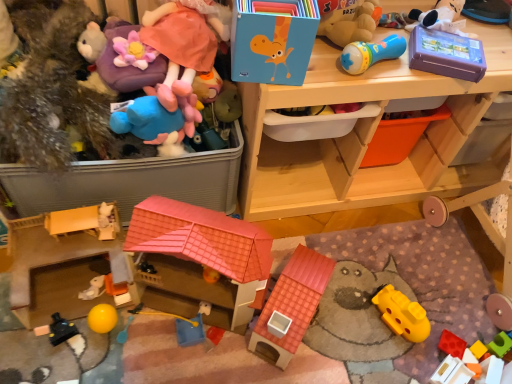
What are the coordinates of `free space in front of yellow rubber ball at lower left, the fourth toy from the left` in the screenshot? It's located at (82, 363).